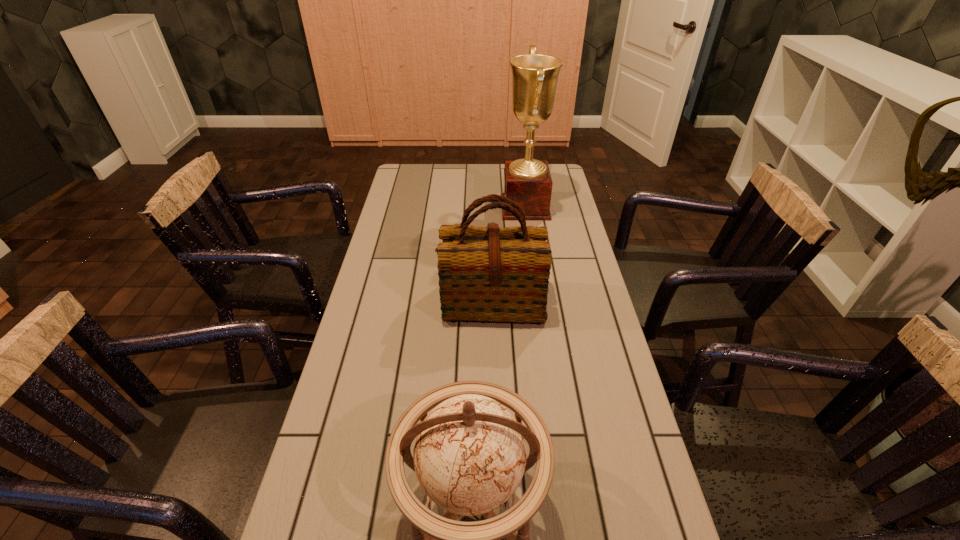
In order to click on trophy cup in this screenshot , I will do pyautogui.click(x=527, y=181).

Locate an element on the screen. This screenshot has width=960, height=540. the tallest object is located at coordinates (527, 181).

Locate an element on the screen. the second nearest object is located at coordinates (496, 274).

The image size is (960, 540). Find the location of `free point located 0.180m on the plaque of the farthest object`. free point located 0.180m on the plaque of the farthest object is located at coordinates (456, 207).

At what (x,y) coordinates should I click in order to perform the action: click on free region located 0.340m on the plaque of the farthest object. Please return your answer as a coordinate pair (x, y). Image resolution: width=960 pixels, height=540 pixels. Looking at the image, I should click on (416, 207).

Locate an element on the screen. The image size is (960, 540). free space located on the plaque of the farthest object is located at coordinates (471, 207).

Find the location of `blank space located on the open handle side of the shopping bag`. blank space located on the open handle side of the shopping bag is located at coordinates (497, 449).

The width and height of the screenshot is (960, 540). Identify the location of object situated at the far edge. (527, 181).

At what (x,y) coordinates should I click in order to perform the action: click on object present at the right edge. Please return your answer as a coordinate pair (x, y). This screenshot has height=540, width=960. Looking at the image, I should click on (527, 181).

I want to click on object that is at the far right corner, so click(527, 181).